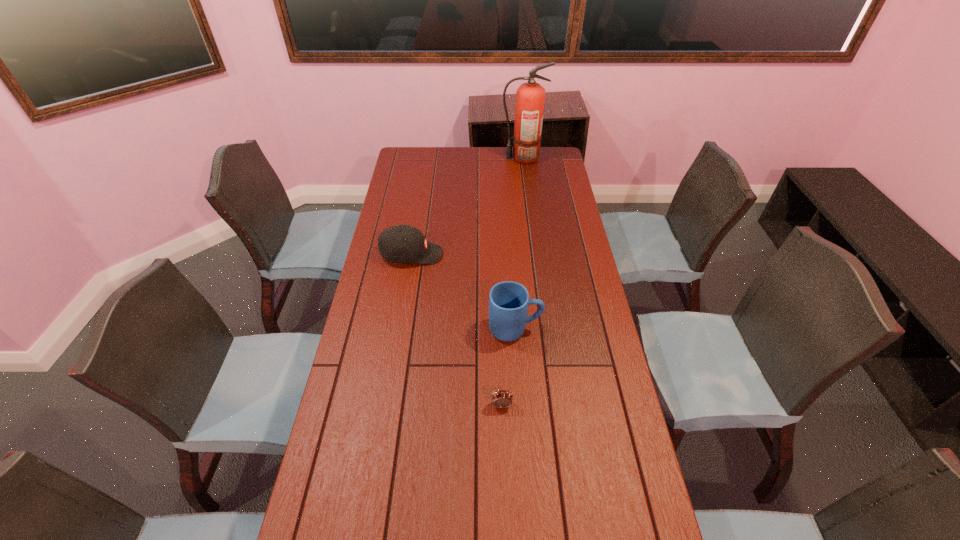
The image size is (960, 540). In order to click on fire extinguisher in this screenshot , I will do `click(530, 97)`.

Locate an element on the screen. the farthest object is located at coordinates (530, 97).

The width and height of the screenshot is (960, 540). I want to click on mug, so click(508, 301).

Locate an element on the screen. Image resolution: width=960 pixels, height=540 pixels. the third shortest object is located at coordinates (508, 301).

What are the coordinates of `the leftmost object` in the screenshot? It's located at (402, 243).

At what (x,y) coordinates should I click in order to perform the action: click on the second farthest object. Please return your answer as a coordinate pair (x, y). This screenshot has width=960, height=540. Looking at the image, I should click on (402, 243).

Locate an element on the screen. alarm clock is located at coordinates (502, 398).

This screenshot has height=540, width=960. What are the coordinates of `the nearest object` in the screenshot? It's located at (502, 398).

Image resolution: width=960 pixels, height=540 pixels. I want to click on free space located on the nozzle of the fire extinguisher, so click(x=467, y=158).

Locate an element on the screen. vacant area located 0.130m on the nozzle of the fire extinguisher is located at coordinates (474, 158).